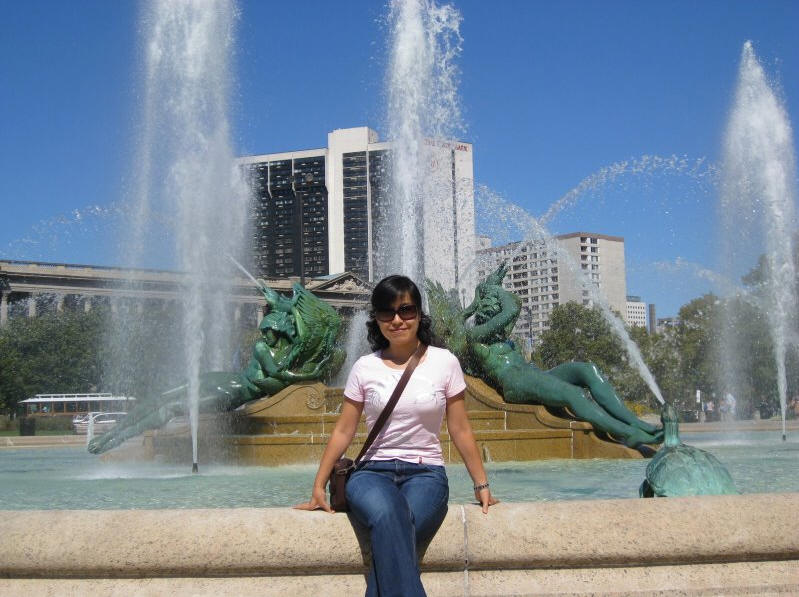
The image size is (799, 597). I want to click on trolley, so click(x=73, y=407).